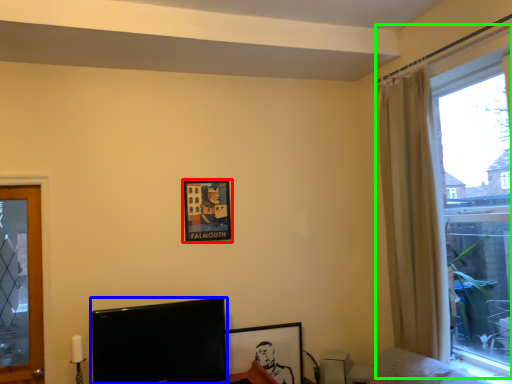
Question: Considering the real-world distances, which object is closest to picture frame (highlighted by a red box)? television (highlighted by a blue box) or window (highlighted by a green box).

Choices:
 (A) television
 (B) window

Answer: (A)